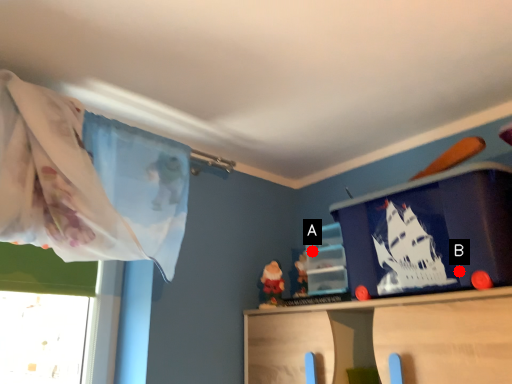
Question: Two points are circled on the image, labeled by A and B beside each circle. Among these points, which one is farthest from the camera?

Choices:
 (A) A is further
 (B) B is further

Answer: (A)